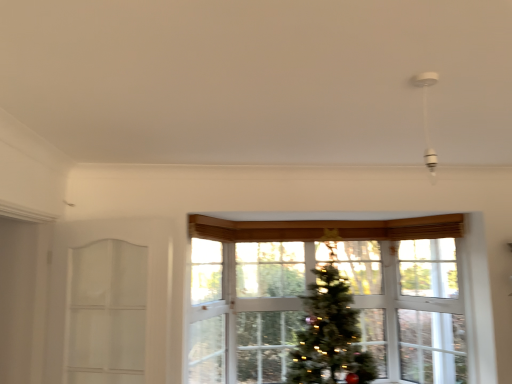
Question: Relative to clear glass window at center, is white glass door at left in front or behind?

Choices:
 (A) front
 (B) behind

Answer: (A)

Question: From a real-world perspective, is white glass door at left positioned above or below clear glass window at center?

Choices:
 (A) below
 (B) above

Answer: (B)

Question: Is white glass door at left bigger or smaller than clear glass window at center?

Choices:
 (A) big
 (B) small

Answer: (B)

Question: Does point (379, 309) appear closer or farther from the camera than point (71, 284)?

Choices:
 (A) closer
 (B) farther

Answer: (B)

Question: Which is correct: clear glass window at center is inside white glass door at left, or outside of it?

Choices:
 (A) inside
 (B) outside

Answer: (B)

Question: Looking at their shapes, would you say clear glass window at center is wider or thinner than white glass door at left?

Choices:
 (A) thin
 (B) wide

Answer: (B)

Question: From the image's perspective, is clear glass window at center positioned above or below white glass door at left?

Choices:
 (A) below
 (B) above

Answer: (A)